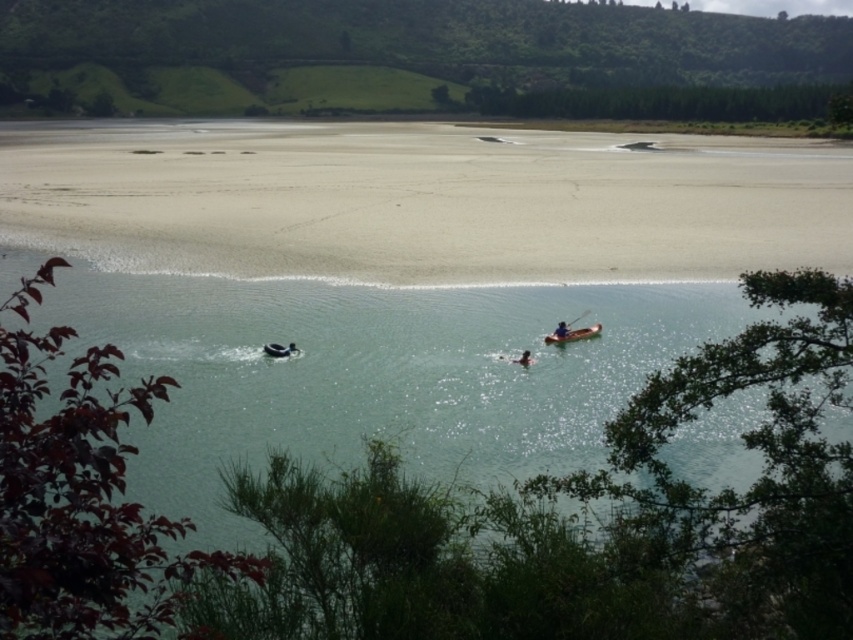
You are standing on the sandy beach in the middle ground of the coastal scene. You want to walk to the clear water at center marked by point [503,456]. Is the path between you and the clear water at center obstructed by any of the two boats?

The clear water at center marked by point [503,456] is in the middle of the water, and the two boats are located there. Since the motorized inflatable boat and wooden canoe are in the middle of the water where the clear water at center is, the path to the clear water at center would be obstructed by these boats.

Looking at this image, you are standing on the sandy shore at lower center and want to place the black rubber ring at lower center so it doesn

The sandy shore at lower center is larger in size than the black rubber ring at lower center, so there is enough space to place the black rubber ring at lower center on the sandy shore at lower center.

You are standing on the beach in the middle ground of the coastal scene. You see a point marked at coordinates (523,358). What object is located at that point?

The point at coordinates (523,358) indicates the location of the smooth brown kayak at center.